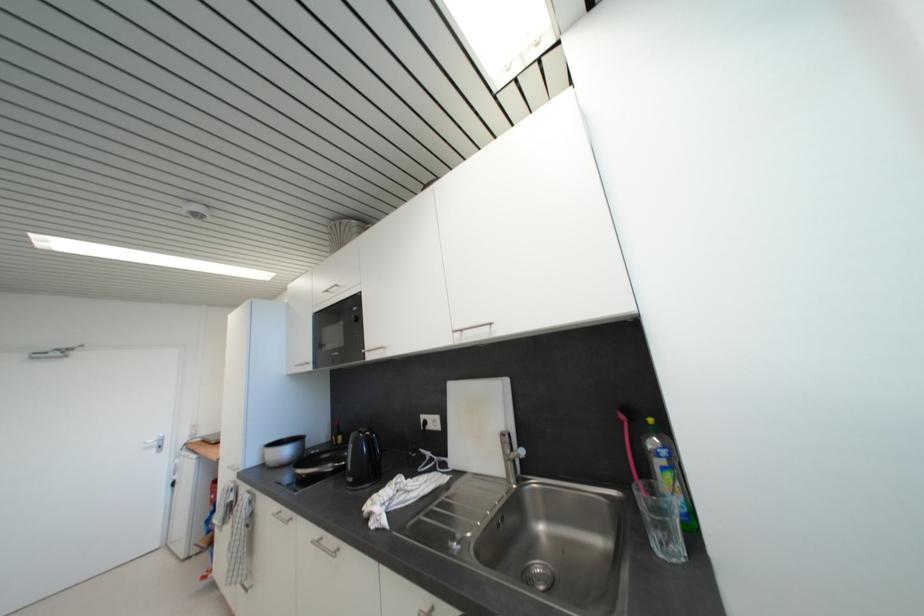
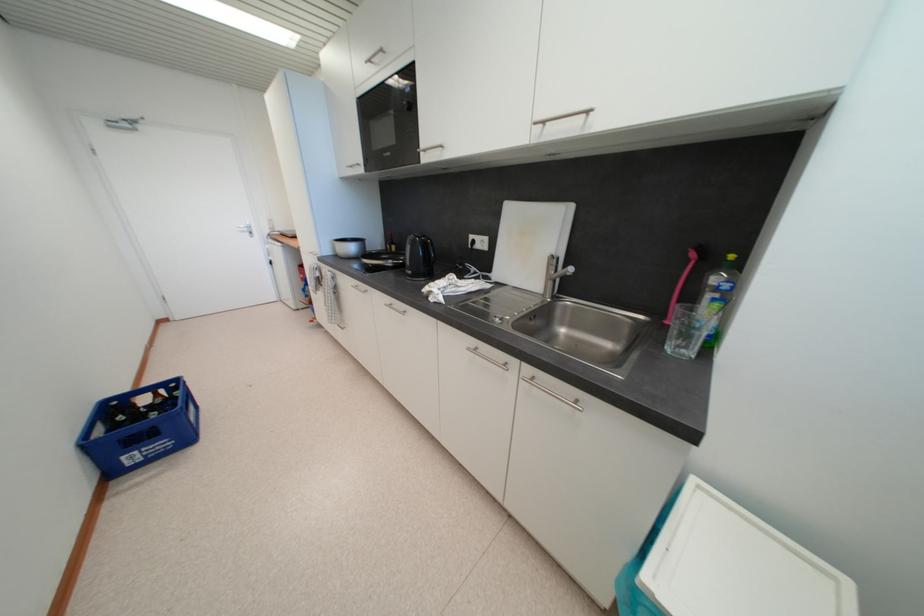
Question: The images are taken continuously from a first-person perspective. In which direction is your viewpoint rotating?

Choices:
 (A) Left
 (B) Right
 (C) Up
 (D) Down

Answer: (D)